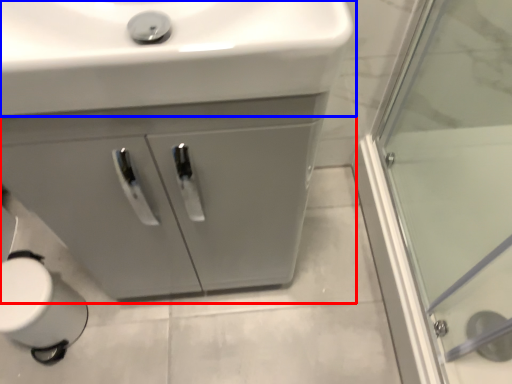
Question: Which object is further to the camera taking this photo, bathroom cabinet (highlighted by a red box) or sink (highlighted by a blue box)?

Choices:
 (A) bathroom cabinet
 (B) sink

Answer: (A)